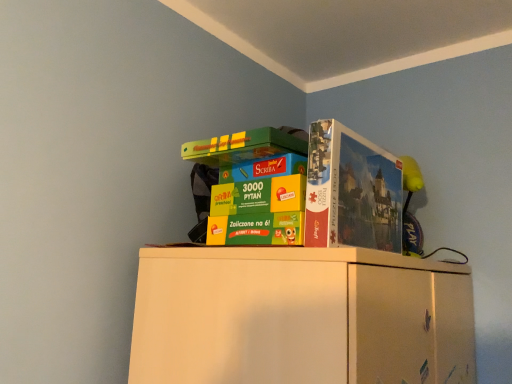
What are the coordinates of `matte cardboard puzzle box at upper right` in the screenshot? It's located at (351, 191).

Describe the element at coordinates (351, 191) in the screenshot. I see `matte cardboard puzzle box at upper right` at that location.

Where is `multicolored cardboard boxes at upper center`? The width and height of the screenshot is (512, 384). multicolored cardboard boxes at upper center is located at coordinates pos(351,191).

This screenshot has width=512, height=384. What do you see at coordinates (351, 191) in the screenshot?
I see `multicolored cardboard boxes at upper center` at bounding box center [351, 191].

Identify the location of matte cardboard puzzle box at upper right. The image size is (512, 384). (351, 191).

Visually, is matte cardboard puzzle box at upper right positioned to the left or to the right of multicolored cardboard boxes at upper center?

In the image, matte cardboard puzzle box at upper right appears on the right side of multicolored cardboard boxes at upper center.

Which object is further away from the camera, matte cardboard puzzle box at upper right or multicolored cardboard boxes at upper center?

matte cardboard puzzle box at upper right is more distant.

Is point (308, 146) positioned in front of point (389, 199)?

Yes, point (308, 146) is closer to viewer.

From the image's perspective, is matte cardboard puzzle box at upper right on top of multicolored cardboard boxes at upper center?

Indeed, from the image's perspective, matte cardboard puzzle box at upper right is shown above multicolored cardboard boxes at upper center.

From a real-world perspective, between matte cardboard puzzle box at upper right and multicolored cardboard boxes at upper center, who is vertically higher?

matte cardboard puzzle box at upper right is physically above.

Based on the photo, which of these two, matte cardboard puzzle box at upper right or multicolored cardboard boxes at upper center, is wider?

multicolored cardboard boxes at upper center is wider.

Can you confirm if matte cardboard puzzle box at upper right is taller than multicolored cardboard boxes at upper center?

No, matte cardboard puzzle box at upper right is not taller than multicolored cardboard boxes at upper center.

Who is bigger, matte cardboard puzzle box at upper right or multicolored cardboard boxes at upper center?

Bigger between the two is multicolored cardboard boxes at upper center.

Is matte cardboard puzzle box at upper right inside the boundaries of multicolored cardboard boxes at upper center, or outside?

matte cardboard puzzle box at upper right lies outside multicolored cardboard boxes at upper center.

Are matte cardboard puzzle box at upper right and multicolored cardboard boxes at upper center beside each other?

Indeed, matte cardboard puzzle box at upper right and multicolored cardboard boxes at upper center are beside each other and touching.

Is matte cardboard puzzle box at upper right oriented towards multicolored cardboard boxes at upper center?

Yes, matte cardboard puzzle box at upper right is turned towards multicolored cardboard boxes at upper center.

How many degrees apart are the facing directions of matte cardboard puzzle box at upper right and multicolored cardboard boxes at upper center?

matte cardboard puzzle box at upper right and multicolored cardboard boxes at upper center are facing 0.00941 degrees away from each other.

How much distance is there between matte cardboard puzzle box at upper right and multicolored cardboard boxes at upper center?

They are 2.03 centimeters apart.

Locate an element on the screen. The image size is (512, 384). paperback book located on the right of multicolored cardboard boxes at upper center is located at coordinates (351, 191).

Visually, is multicolored cardboard boxes at upper center positioned to the left or to the right of matte cardboard puzzle box at upper right?

multicolored cardboard boxes at upper center is positioned on matte cardboard puzzle box at upper right's left side.

Which is behind, multicolored cardboard boxes at upper center or matte cardboard puzzle box at upper right?

matte cardboard puzzle box at upper right is further from the camera.

Considering the positions of point (371, 241) and point (319, 201), is point (371, 241) closer or farther from the camera than point (319, 201)?

Point (371, 241) appears to be farther away from the viewer than point (319, 201).

From the image's perspective, would you say multicolored cardboard boxes at upper center is shown under matte cardboard puzzle box at upper right?

Correct, multicolored cardboard boxes at upper center appears lower than matte cardboard puzzle box at upper right in the image.

From a real-world perspective, does multicolored cardboard boxes at upper center stand above matte cardboard puzzle box at upper right?

Actually, multicolored cardboard boxes at upper center is physically below matte cardboard puzzle box at upper right in the real world.

In terms of width, does multicolored cardboard boxes at upper center look wider or thinner when compared to matte cardboard puzzle box at upper right?

In the image, multicolored cardboard boxes at upper center appears to be wider than matte cardboard puzzle box at upper right.

Looking at this image, considering the sizes of objects multicolored cardboard boxes at upper center and matte cardboard puzzle box at upper right in the image provided, who is shorter, multicolored cardboard boxes at upper center or matte cardboard puzzle box at upper right?

matte cardboard puzzle box at upper right.

Considering the sizes of multicolored cardboard boxes at upper center and matte cardboard puzzle box at upper right in the image, is multicolored cardboard boxes at upper center bigger or smaller than matte cardboard puzzle box at upper right?

multicolored cardboard boxes at upper center is bigger than matte cardboard puzzle box at upper right.

Choose the correct answer: Is multicolored cardboard boxes at upper center inside matte cardboard puzzle box at upper right or outside it?

multicolored cardboard boxes at upper center is outside matte cardboard puzzle box at upper right.

Is multicolored cardboard boxes at upper center not close to matte cardboard puzzle box at upper right?

No, multicolored cardboard boxes at upper center is not far from matte cardboard puzzle box at upper right.

Is multicolored cardboard boxes at upper center aimed at matte cardboard puzzle box at upper right?

Yes, multicolored cardboard boxes at upper center is aimed at matte cardboard puzzle box at upper right.

What's the angular difference between multicolored cardboard boxes at upper center and matte cardboard puzzle box at upper right's facing directions?

They differ by 0.00941 degrees in their facing directions.

How distant is multicolored cardboard boxes at upper center from matte cardboard puzzle box at upper right?

A distance of 0.80 inches exists between multicolored cardboard boxes at upper center and matte cardboard puzzle box at upper right.

At what (x,y) coordinates should I click in order to perform the action: click on paperback book above the multicolored cardboard boxes at upper center (from the image's perspective). Please return your answer as a coordinate pair (x, y). The image size is (512, 384). Looking at the image, I should click on (351, 191).

Identify the location of paperback book above the multicolored cardboard boxes at upper center (from a real-world perspective). This screenshot has width=512, height=384. (351, 191).

Identify the location of paperback book on the right of multicolored cardboard boxes at upper center. (351, 191).